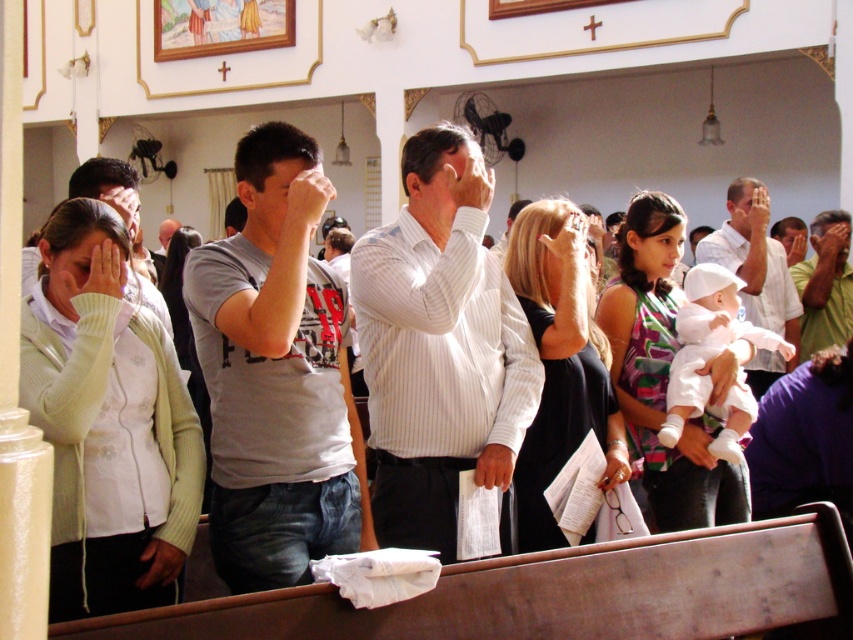
You are standing in the church and want to determine which of the two points, point [235,314] or point [751,220], is nearer to you. Based on the scene description, which point is closer?

Point [235,314] is closer to the camera than point [751,220], so it is the nearer point.

You are standing at the camera position and want to hand a small note to the person wearing the white striped shirt at center. Can you reach them without moving from your current position?

The distance between you and the white striped shirt at center is 15.58 meters, so you cannot reach them without moving closer.